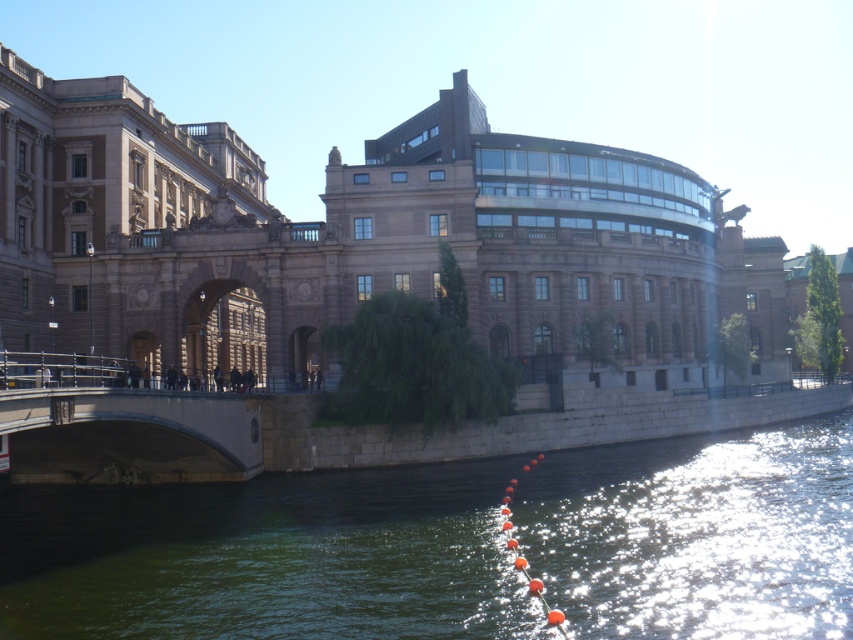
Question: Can you confirm if green stone river at lower left is smaller than concrete bridge at lower left?

Choices:
 (A) no
 (B) yes

Answer: (A)

Question: Which object is farther from the camera taking this photo?

Choices:
 (A) green stone river at lower left
 (B) concrete bridge at lower left

Answer: (B)

Question: Which object appears farthest from the camera in this image?

Choices:
 (A) concrete bridge at lower left
 (B) green stone river at lower left

Answer: (A)

Question: Is green stone river at lower left smaller than concrete bridge at lower left?

Choices:
 (A) yes
 (B) no

Answer: (B)

Question: Among these objects, which one is nearest to the camera?

Choices:
 (A) green stone river at lower left
 (B) concrete bridge at lower left

Answer: (A)

Question: Is green stone river at lower left in front of concrete bridge at lower left?

Choices:
 (A) yes
 (B) no

Answer: (A)